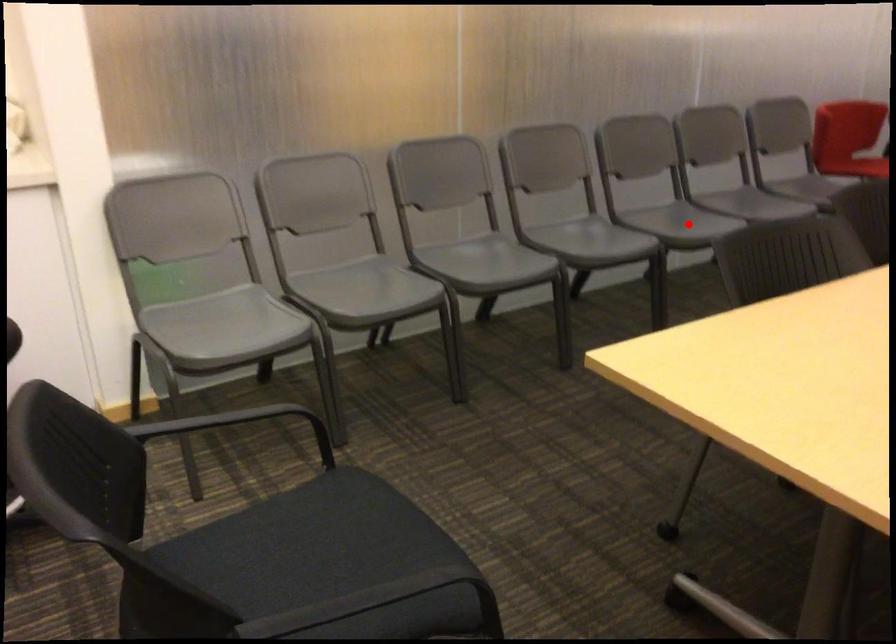
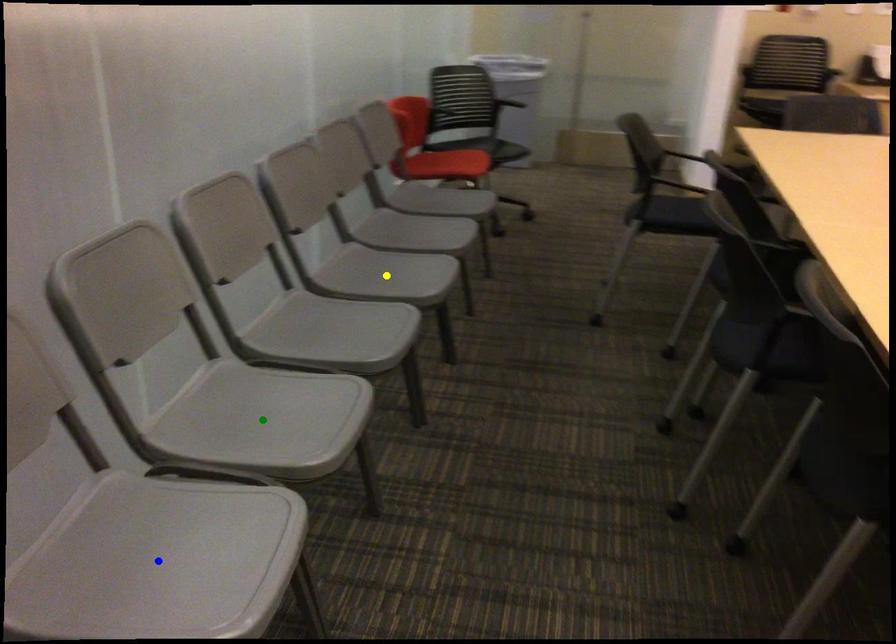
Question: I am providing you with two images of the same scene from different viewpoints. A red point is marked on the first image. You are given multiple points on the second image. In image 2, which mark is for the same physical point as the one in image 1?

Choices:
 (A) yellow point
 (B) green point
 (C) blue point

Answer: (A)